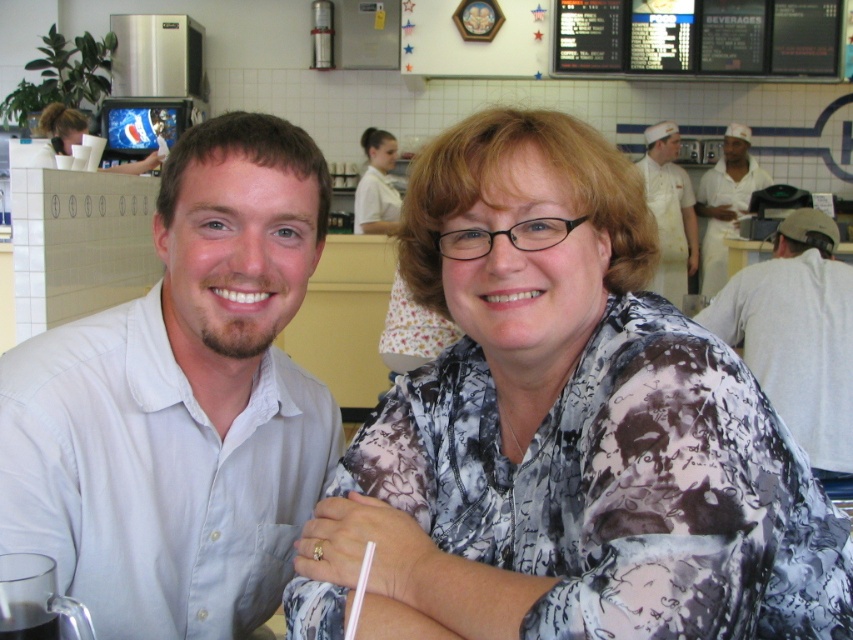
Question: Does light blue shirt at left have a greater width compared to gray cotton shirt at right?

Choices:
 (A) yes
 (B) no

Answer: (B)

Question: Can you confirm if white uniform at center is thinner than clear plastic cup at lower left?

Choices:
 (A) no
 (B) yes

Answer: (A)

Question: Which object is the farthest from the gray cotton shirt at right?

Choices:
 (A) clear plastic cup at lower left
 (B) white uniform at right
 (C) printed fabric blouse at center
 (D) light blue shirt at left

Answer: (A)

Question: Is the position of gray cotton shirt at right more distant than that of white printed blouse at center?

Choices:
 (A) no
 (B) yes

Answer: (A)

Question: Which of the following is the closest to the observer?

Choices:
 (A) (51, 456)
 (B) (705, 260)
 (C) (757, 253)

Answer: (A)

Question: Among these points, which one is nearest to the camera?

Choices:
 (A) (683, 275)
 (B) (44, 632)

Answer: (B)